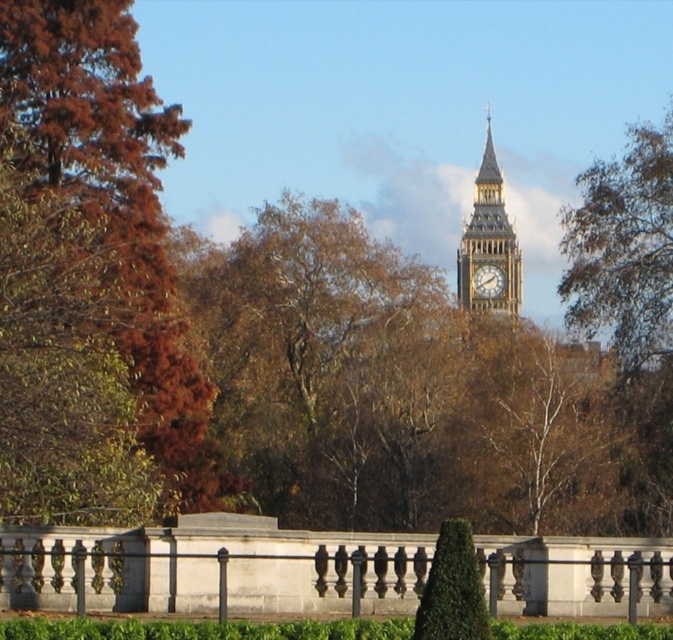
You are standing in the scenic view of the clock tower and want to walk towards the point marked at coordinates point [61,195] and point [501,192]. Which point will you reach first?

You will reach point [61,195] first because it is in front of point [501,192], meaning it is closer to your current position.

You are standing in the scenic view and want to take a photo of both the brown leafy tree at left and the green textured hedge at center. Which object should you adjust your camera angle to include first if you want to frame them both in the shot?

The brown leafy tree at left is positioned on the left side of the green textured hedge at center, so you should adjust your camera angle to include the brown leafy tree at left first as it is to the left of the hedge.

You are standing in the scenic area and want to take a photo of both the brown leafy tree at left and the green textured hedge at center. Which object should you focus on first to ensure both are in clear view?

You should focus on the brown leafy tree at left first because it is closer to you than the green textured hedge at center, ensuring both are in clear view.